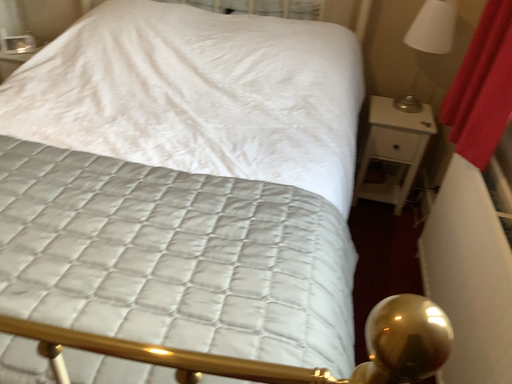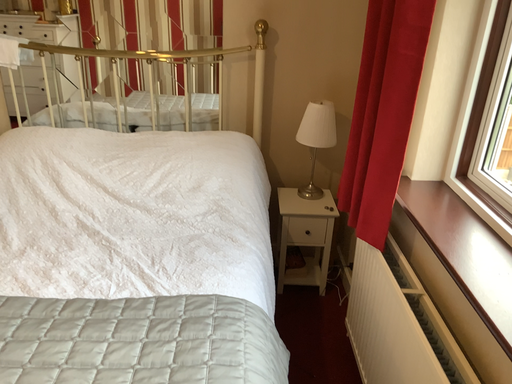
Question: How did the camera likely rotate when shooting the video?

Choices:
 (A) rotated right
 (B) rotated left

Answer: (A)